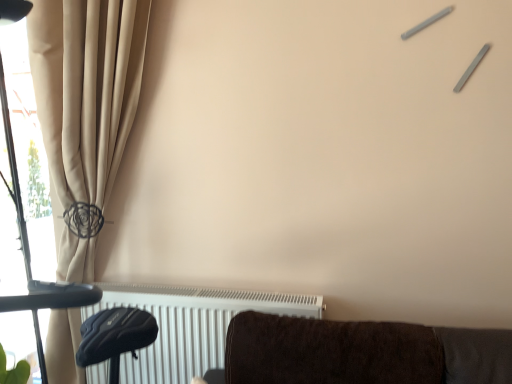
Question: Should I look upward or downward to see white metallic radiator at lower center?

Choices:
 (A) down
 (B) up

Answer: (A)

Question: From a real-world perspective, is white metallic radiator at lower center over beige fabric curtain at left?

Choices:
 (A) no
 (B) yes

Answer: (A)

Question: Is white metallic radiator at lower center at the left side of beige fabric curtain at left?

Choices:
 (A) yes
 (B) no

Answer: (B)

Question: Is the surface of white metallic radiator at lower center in direct contact with beige fabric curtain at left?

Choices:
 (A) no
 (B) yes

Answer: (A)

Question: Would you say beige fabric curtain at left is part of white metallic radiator at lower center's contents?

Choices:
 (A) no
 (B) yes

Answer: (A)

Question: Can you confirm if white metallic radiator at lower center is smaller than beige fabric curtain at left?

Choices:
 (A) yes
 (B) no

Answer: (A)

Question: Is white metallic radiator at lower center far from beige fabric curtain at left?

Choices:
 (A) yes
 (B) no

Answer: (B)

Question: From the image's perspective, is beige fabric curtain at left located beneath white metallic radiator at lower center?

Choices:
 (A) no
 (B) yes

Answer: (A)

Question: Could you tell me if beige fabric curtain at left is facing white metallic radiator at lower center?

Choices:
 (A) yes
 (B) no

Answer: (A)

Question: Is beige fabric curtain at left to the left of white metallic radiator at lower center from the viewer's perspective?

Choices:
 (A) no
 (B) yes

Answer: (B)

Question: Considering the relative sizes of beige fabric curtain at left and white metallic radiator at lower center in the image provided, is beige fabric curtain at left thinner than white metallic radiator at lower center?

Choices:
 (A) no
 (B) yes

Answer: (A)

Question: Is beige fabric curtain at left turned away from white metallic radiator at lower center?

Choices:
 (A) no
 (B) yes

Answer: (B)

Question: Is beige fabric curtain at left wider than white metallic radiator at lower center?

Choices:
 (A) no
 (B) yes

Answer: (B)

Question: Is point (205, 321) closer or farther from the camera than point (58, 165)?

Choices:
 (A) closer
 (B) farther

Answer: (A)